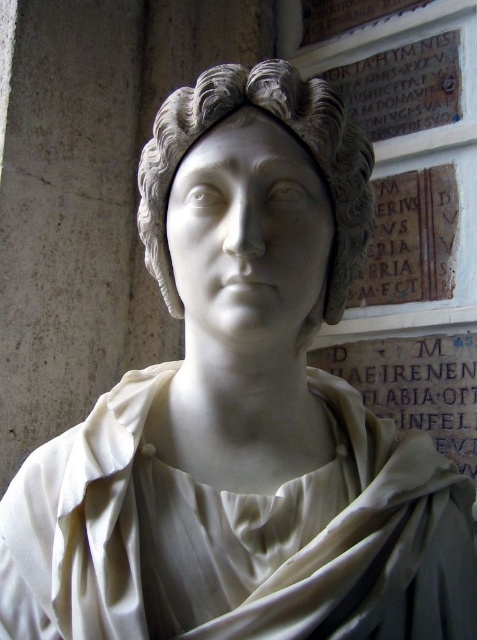
Question: Can you confirm if white marble head at center is thinner than white marble inscription at lower right?

Choices:
 (A) no
 (B) yes

Answer: (A)

Question: Can you confirm if white marble head at center is smaller than white marble inscription at lower right?

Choices:
 (A) yes
 (B) no

Answer: (B)

Question: Can you confirm if white marble head at center is thinner than white marble inscription at lower right?

Choices:
 (A) no
 (B) yes

Answer: (A)

Question: Which point is farther from the camera taking this photo?

Choices:
 (A) (386, 342)
 (B) (290, 112)

Answer: (A)